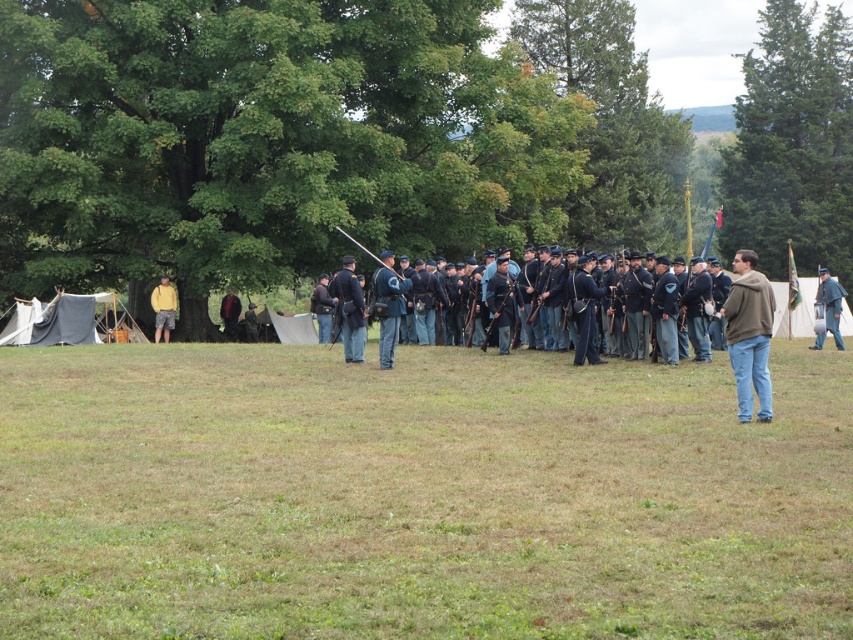
Question: Does dark blue uniform at center appear on the right side of blue wool uniform at center?

Choices:
 (A) yes
 (B) no

Answer: (B)

Question: Which point is closer to the camera taking this photo?

Choices:
 (A) (231, 300)
 (B) (173, 305)
 (C) (370, 307)
 (D) (401, 582)

Answer: (D)

Question: Which object appears closest to the camera in this image?

Choices:
 (A) dark brown leather jacket at center
 (B) yellow cotton shirt at left

Answer: (B)

Question: Is green grass at center thinner than blue cotton uniform at center?

Choices:
 (A) no
 (B) yes

Answer: (A)

Question: Does green grass at center lie in front of blue wool uniform at center?

Choices:
 (A) no
 (B) yes

Answer: (B)

Question: Which object appears farthest from the camera in this image?

Choices:
 (A) blue cotton uniform at center
 (B) dark blue uniform at center

Answer: (B)